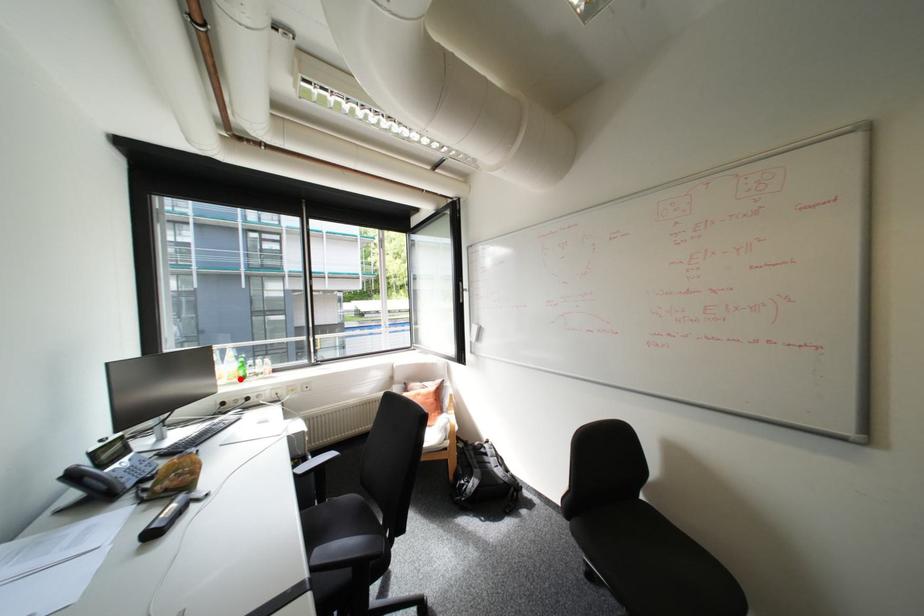
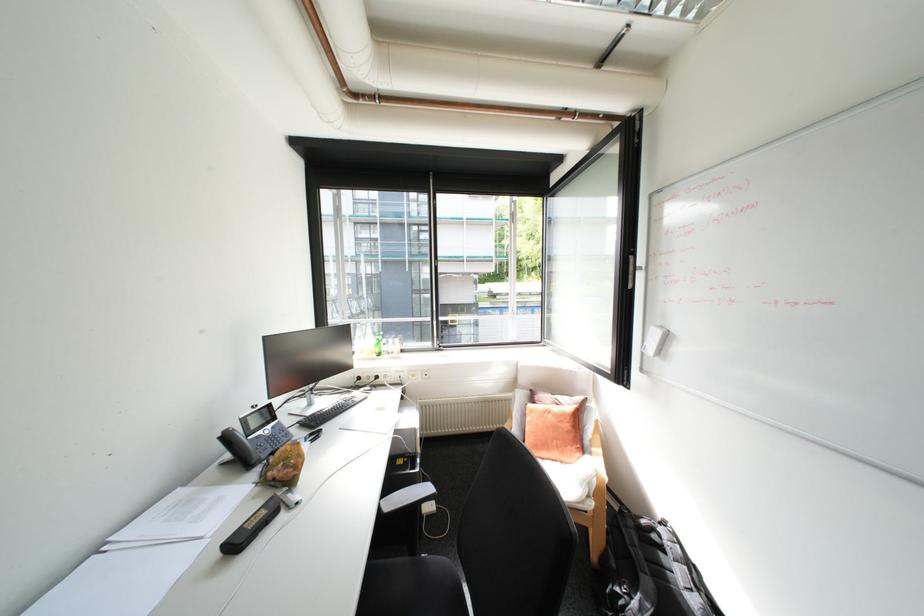
Find the pixel in the second image that matches the highlighted location in the first image.

(379, 354)